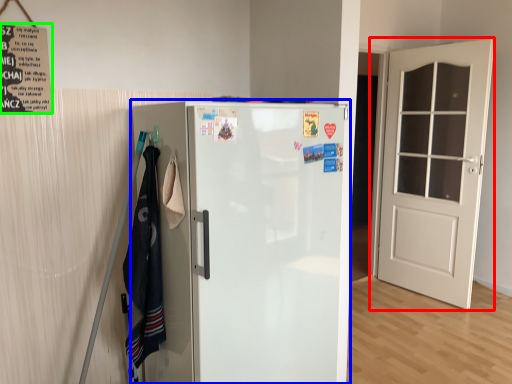
Question: Which object is positioned farthest from door (highlighted by a red box)? Select from refrigerator (highlighted by a blue box) and poster (highlighted by a green box).

Choices:
 (A) refrigerator
 (B) poster

Answer: (B)